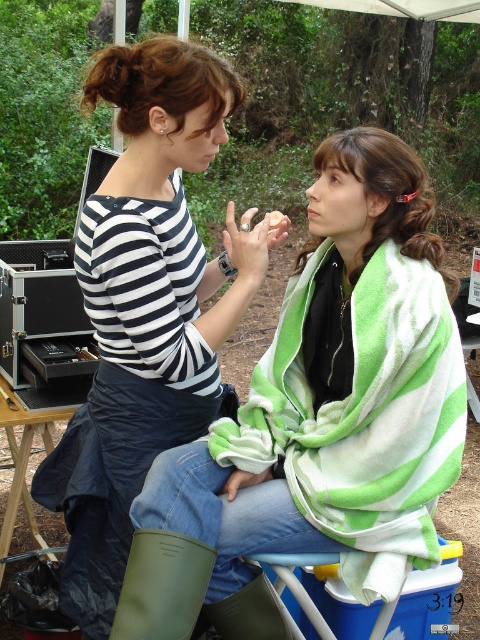
Can you confirm if striped fabric shirt at center is positioned below green rubber boot at lower left?

No.

Is point (108, 433) less distant than point (190, 598)?

No.

I want to click on striped fabric shirt at center, so click(145, 307).

Who is more forward, (183, 488) or (96, 600)?

Point (183, 488) is more forward.

Is green striped towel at center to the left of striped fabric shirt at center from the viewer's perspective?

Incorrect, green striped towel at center is not on the left side of striped fabric shirt at center.

Who is more forward, (415, 460) or (151, 260)?

Point (415, 460) is in front.

Locate an element on the screen. The image size is (480, 640). green striped towel at center is located at coordinates (321, 410).

Which is above, green striped towel at center or green rubber boot at lower left?

green striped towel at center

Is the position of green striped towel at center more distant than that of green rubber boot at lower left?

That is True.

Between point (208, 436) and point (149, 620), which one is positioned in front?

Point (149, 620) is more forward.

This screenshot has width=480, height=640. I want to click on green striped towel at center, so click(x=321, y=410).